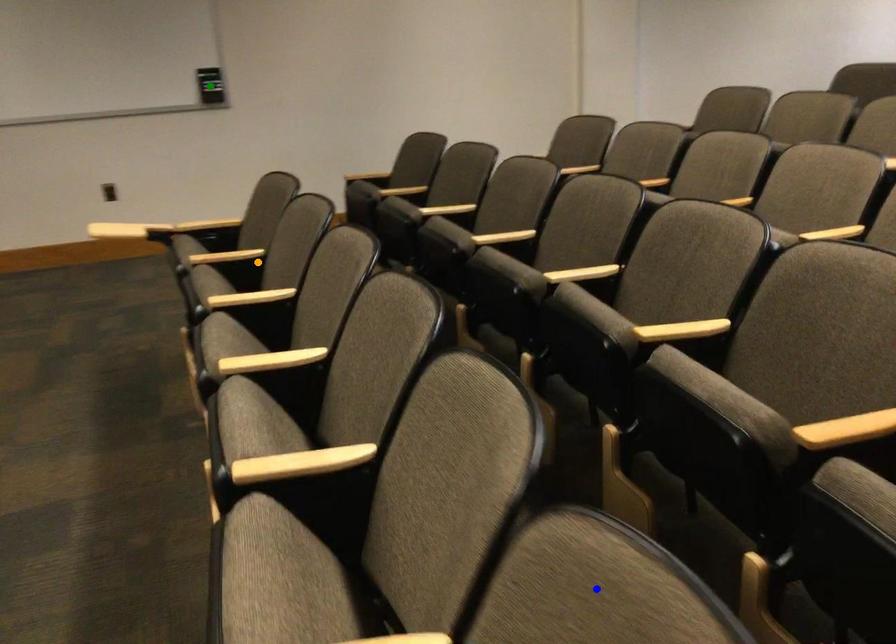
Order these from farthest to nearest:
- orange point
- green point
- blue point

green point < orange point < blue point